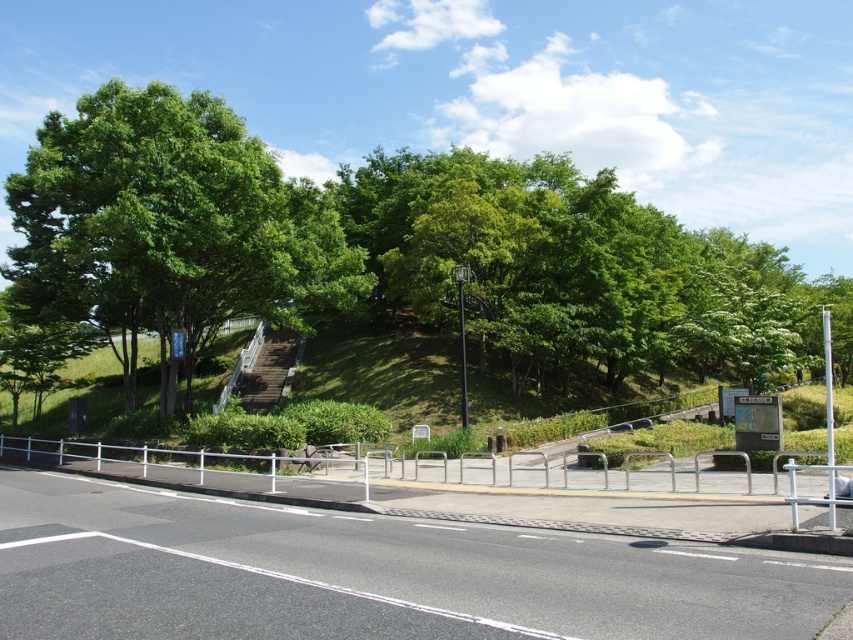
You are standing on the paved road and want to walk towards the green leafy tree at upper center. Which direction should you turn to avoid the black metal pole at center?

Since the green leafy tree at upper center is to the right of the black metal pole at center, you should turn right to walk towards the tree while avoiding the pole.